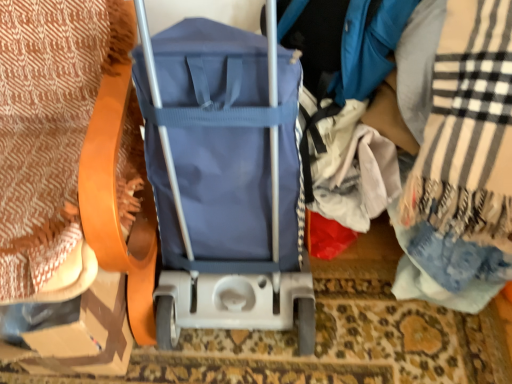
Question: Is plaid woolen blanket at right, the second blanket positioned from the left, oriented towards patterned fabric blanket at left, arranged as the first blanket when viewed from the left?

Choices:
 (A) no
 (B) yes

Answer: (B)

Question: Is plaid woolen blanket at right, which appears as the 1th blanket when viewed from the right, not inside patterned fabric blanket at left, arranged as the first blanket when viewed from the left?

Choices:
 (A) no
 (B) yes

Answer: (B)

Question: From a real-world perspective, is plaid woolen blanket at right, which appears as the 1th blanket when viewed from the right, over patterned fabric blanket at left, arranged as the first blanket when viewed from the left?

Choices:
 (A) no
 (B) yes

Answer: (A)

Question: Is the position of plaid woolen blanket at right, the second blanket positioned from the left, more distant than that of patterned fabric blanket at left, arranged as the first blanket when viewed from the left?

Choices:
 (A) yes
 (B) no

Answer: (A)

Question: Considering the relative sizes of plaid woolen blanket at right, the second blanket positioned from the left, and patterned fabric blanket at left, arranged as the first blanket when viewed from the left, in the image provided, is plaid woolen blanket at right, the second blanket positioned from the left, bigger than patterned fabric blanket at left, arranged as the first blanket when viewed from the left,?

Choices:
 (A) yes
 (B) no

Answer: (B)

Question: Is plaid woolen blanket at right, the second blanket positioned from the left, thinner than patterned fabric blanket at left, the second blanket when ordered from right to left?

Choices:
 (A) yes
 (B) no

Answer: (A)

Question: Is cardboard at left far from plaid woolen blanket at right, the second blanket positioned from the left?

Choices:
 (A) no
 (B) yes

Answer: (A)

Question: Can you confirm if cardboard at left is taller than plaid woolen blanket at right, which appears as the 1th blanket when viewed from the right?

Choices:
 (A) no
 (B) yes

Answer: (A)

Question: Is cardboard at left to the right of plaid woolen blanket at right, which appears as the 1th blanket when viewed from the right, from the viewer's perspective?

Choices:
 (A) no
 (B) yes

Answer: (A)

Question: Is the surface of cardboard at left in direct contact with plaid woolen blanket at right, which appears as the 1th blanket when viewed from the right?

Choices:
 (A) no
 (B) yes

Answer: (A)

Question: Is cardboard at left wider than plaid woolen blanket at right, which appears as the 1th blanket when viewed from the right?

Choices:
 (A) yes
 (B) no

Answer: (B)

Question: Is cardboard at left aimed at plaid woolen blanket at right, the second blanket positioned from the left?

Choices:
 (A) no
 (B) yes

Answer: (A)

Question: Is cardboard at left behind patterned fabric blanket at left, the second blanket when ordered from right to left?

Choices:
 (A) yes
 (B) no

Answer: (A)